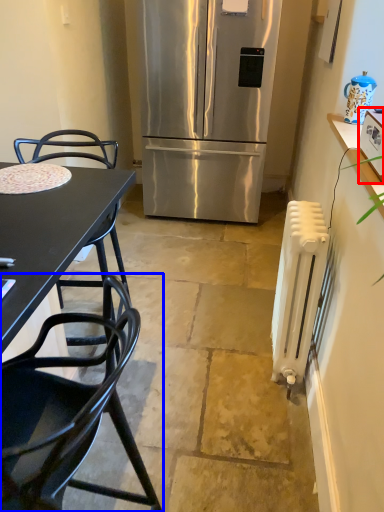
Question: Which object appears closest to the camera in this image, kitchen appliance (highlighted by a red box) or chair (highlighted by a blue box)?

Choices:
 (A) kitchen appliance
 (B) chair

Answer: (B)